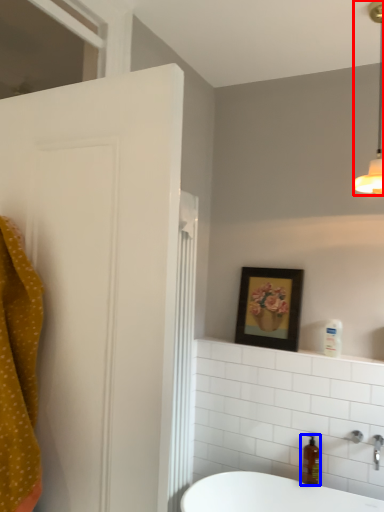
Question: Which object is further to the camera taking this photo, light fixture (highlighted by a red box) or soap dispenser (highlighted by a blue box)?

Choices:
 (A) light fixture
 (B) soap dispenser

Answer: (B)